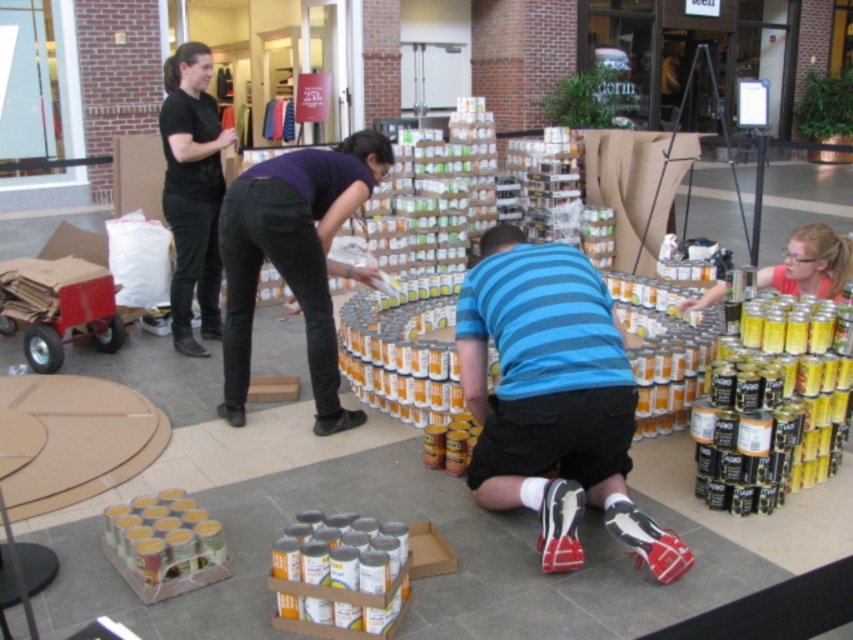
You are standing in the shopping mall and notice two points marked in the scene. Which point, point (544, 296) or point (198, 58), is closer to you?

Point (544, 296) is closer to the camera than point (198, 58), so it is closer to you.

You are standing in the shopping mall where the cans are arranged in a circle. You notice two points marked in the scene. Which point, point 1 at coordinates [271,260] or point 2 at coordinates [213,172], is closer to you?

Point 1 at coordinates [271,260] is closer to you than point 2 at coordinates [213,172].